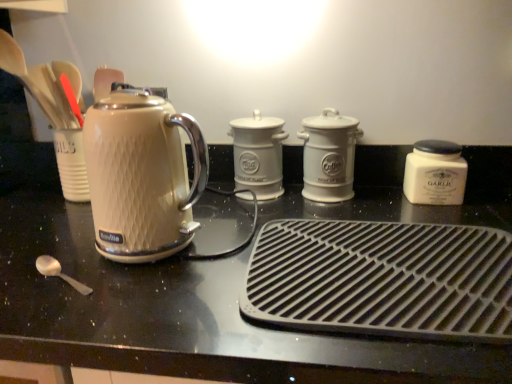
You are a GUI agent. You are given a task and a screenshot of the screen. Output one action in this format:
    pyautogui.click(x=<x>, y=<y>)
    Task: Click on the vacant area to the left of white ceramic jar at right, acting as the 2th kitchen appliance starting from the front
    Image resolution: width=512 pixels, height=384 pixels.
    Given the screenshot: What is the action you would take?
    pyautogui.click(x=373, y=201)